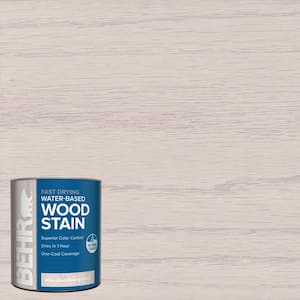
Where is `dark grains in wood`? The height and width of the screenshot is (300, 300). dark grains in wood is located at coordinates click(x=140, y=52), click(x=170, y=189), click(x=183, y=230), click(x=178, y=260).